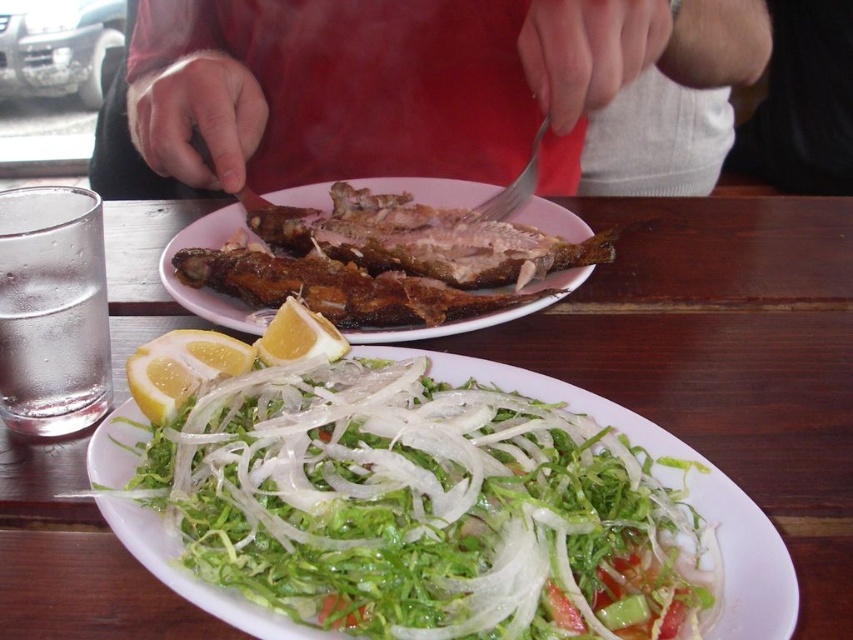
Question: Can you confirm if smooth red shirt at center is positioned to the left of silver metallic fork at upper center?

Choices:
 (A) no
 (B) yes

Answer: (B)

Question: Which point is closer to the camera?

Choices:
 (A) silver metallic fork at upper center
 (B) yellow matte lemon at lower left
 (C) smooth red shirt at center

Answer: (B)

Question: Observing the image, what is the correct spatial positioning of wooden table at center in reference to smooth red shirt at center?

Choices:
 (A) above
 (B) below

Answer: (B)

Question: Which point is farther to the camera?

Choices:
 (A) translucent white shredded vegetable at lower center
 (B) smooth red shirt at center
 (C) wooden table at center
 (D) silver metallic fork at upper center

Answer: (D)

Question: Which point is farther from the camera taking this photo?

Choices:
 (A) (448, 193)
 (B) (534, 186)
 (C) (289, 296)

Answer: (A)

Question: Is translucent white shredded vegetable at lower center below smooth red shirt at center?

Choices:
 (A) yes
 (B) no

Answer: (A)